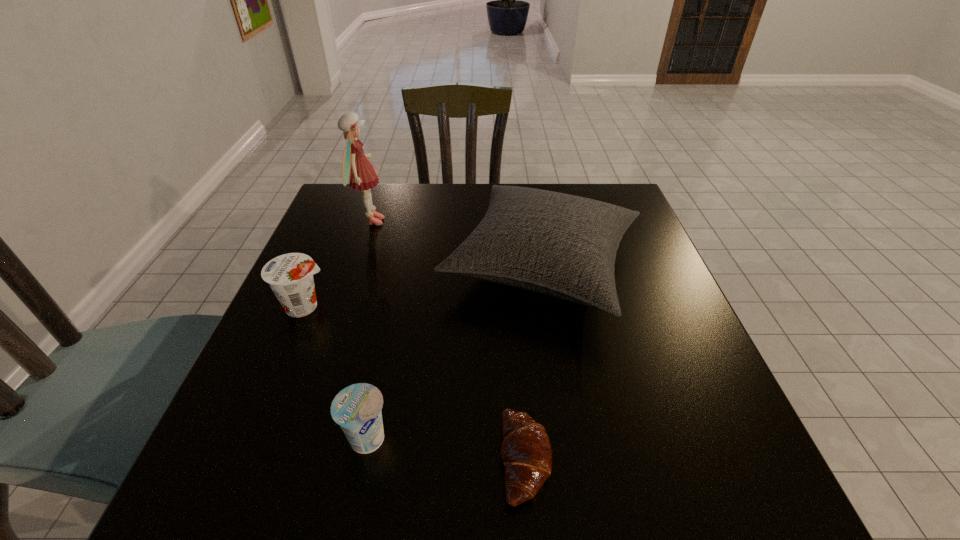
Locate an element on the screen. This screenshot has height=540, width=960. free space at the far edge of the desktop is located at coordinates (476, 189).

Locate an element on the screen. Image resolution: width=960 pixels, height=540 pixels. free space at the near edge of the desktop is located at coordinates (469, 488).

Where is `blank space at the left edge of the desktop`? blank space at the left edge of the desktop is located at coordinates (356, 251).

In the image, there is a desktop. At what (x,y) coordinates should I click in order to perform the action: click on vacant space at the right edge. Please return your answer as a coordinate pair (x, y). The width and height of the screenshot is (960, 540). Looking at the image, I should click on (635, 276).

Identify the location of vacant space at the far left corner. (333, 220).

The image size is (960, 540). Find the location of `vacant space at the far right corner of the desktop`. vacant space at the far right corner of the desktop is located at coordinates (607, 185).

This screenshot has width=960, height=540. I want to click on empty location between the farther yogurt and the shortest object, so click(416, 383).

Image resolution: width=960 pixels, height=540 pixels. In order to click on empty space that is in between the left yogurt and the crescent roll in this screenshot , I will do `click(416, 383)`.

Identify the location of free point between the fourth shortest object and the left yogurt. The image size is (960, 540). (423, 286).

The height and width of the screenshot is (540, 960). Find the location of `vacant space in between the crescent roll and the third object from left to right`. vacant space in between the crescent roll and the third object from left to right is located at coordinates (446, 450).